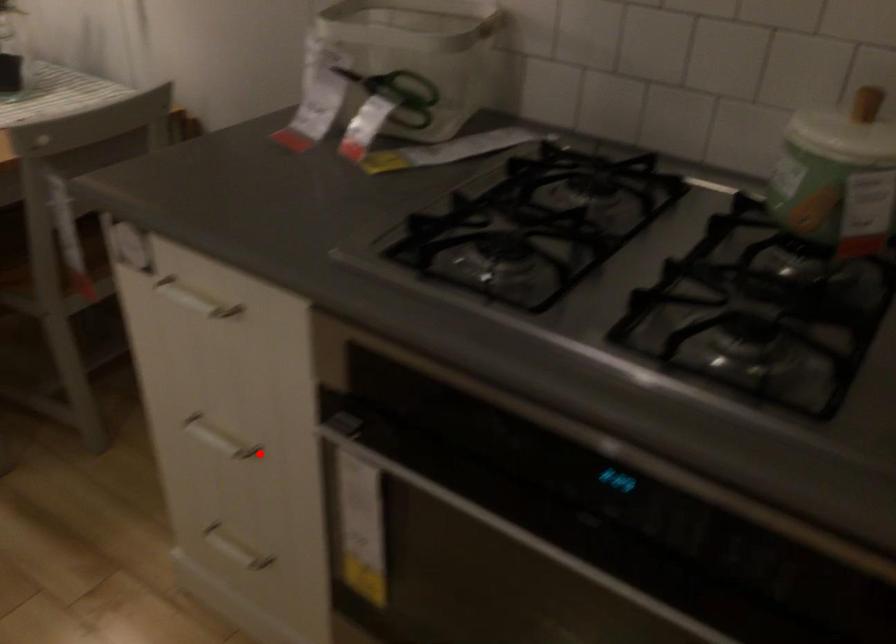
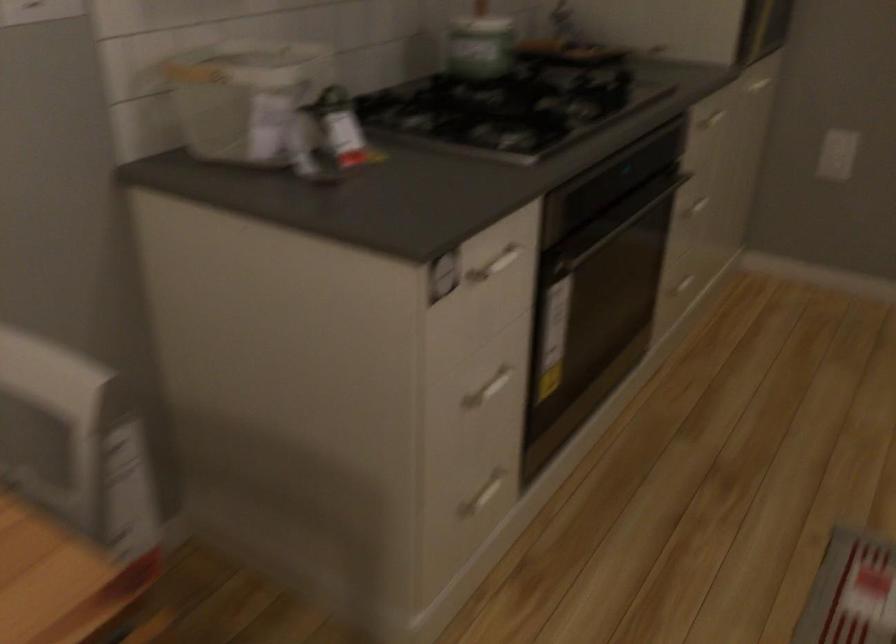
The point at the highlighted location is marked in the first image. Where is the corresponding point in the second image?

(487, 389)